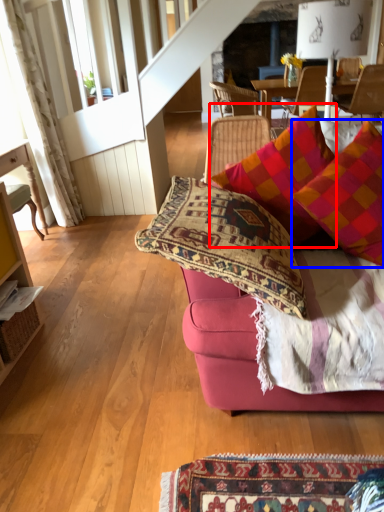
Question: Which of the following is the farthest to the observer, pillow (highlighted by a red box) or pillow (highlighted by a blue box)?

Choices:
 (A) pillow
 (B) pillow

Answer: (A)